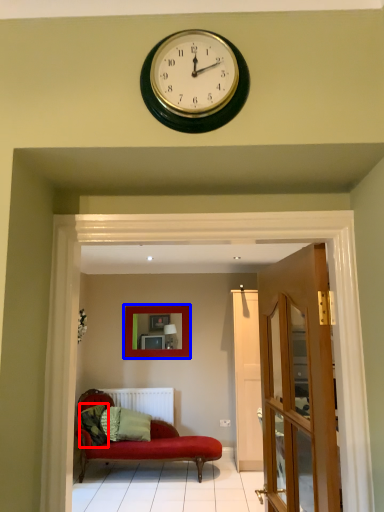
Question: Among these objects, which one is farthest to the camera, pillow (highlighted by a red box) or picture frame (highlighted by a blue box)?

Choices:
 (A) pillow
 (B) picture frame

Answer: (B)